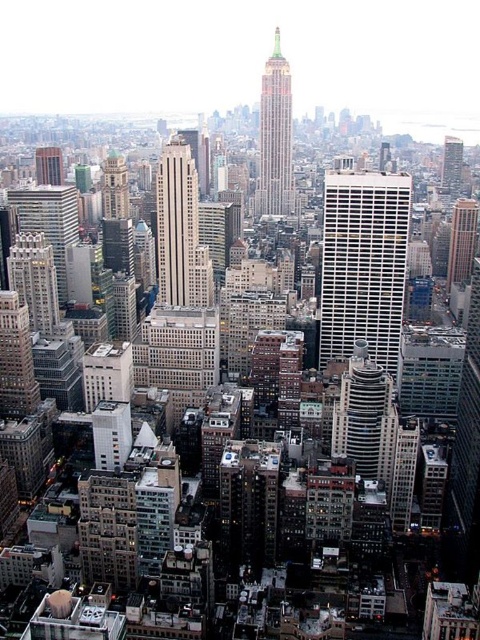
You are a drone operator flying over a city with a drone that has a camera. Your mission is to capture a photo of the smooth beige skyscraper at center. You notice a point at coordinates point [177,225]. Is this point located on the smooth beige skyscraper at center?

Yes, the point [177,225] is located on the smooth beige skyscraper at center as stated in the description.